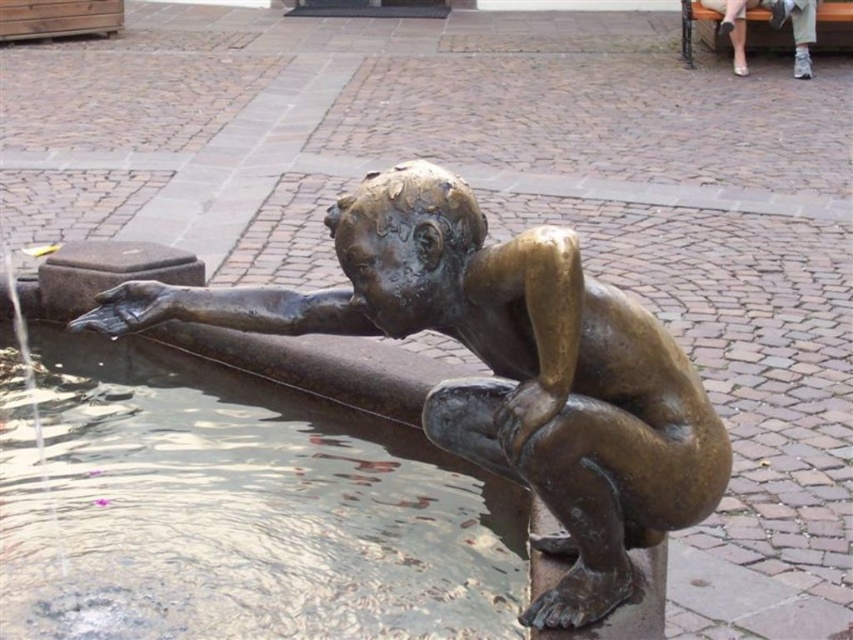
Between clear water at statue center and metallic silver shoes at upper right, which one has more height?

metallic silver shoes at upper right is taller.

Looking at this image, can you confirm if clear water at statue center is bigger than metallic silver shoes at upper right?

Correct, clear water at statue center is larger in size than metallic silver shoes at upper right.

The height and width of the screenshot is (640, 853). What are the coordinates of `clear water at statue center` in the screenshot? It's located at (236, 512).

Find the location of `bronze statue at center`. bronze statue at center is located at coordinates (502, 369).

Between bronze statue at center and metallic silver shoes at upper right, which one is positioned lower?

Positioned lower is bronze statue at center.

Does point (506, 422) lie in front of point (712, 8)?

Yes, it is.

Find the location of a particular element. Image resolution: width=853 pixels, height=640 pixels. bronze statue at center is located at coordinates pos(502,369).

This screenshot has height=640, width=853. What do you see at coordinates (236, 512) in the screenshot?
I see `clear water at statue center` at bounding box center [236, 512].

Can you confirm if clear water at statue center is shorter than bronze statue at center?

Indeed, clear water at statue center has a lesser height compared to bronze statue at center.

At what (x,y) coordinates should I click in order to perform the action: click on clear water at statue center. Please return your answer as a coordinate pair (x, y). This screenshot has height=640, width=853. Looking at the image, I should click on (236, 512).